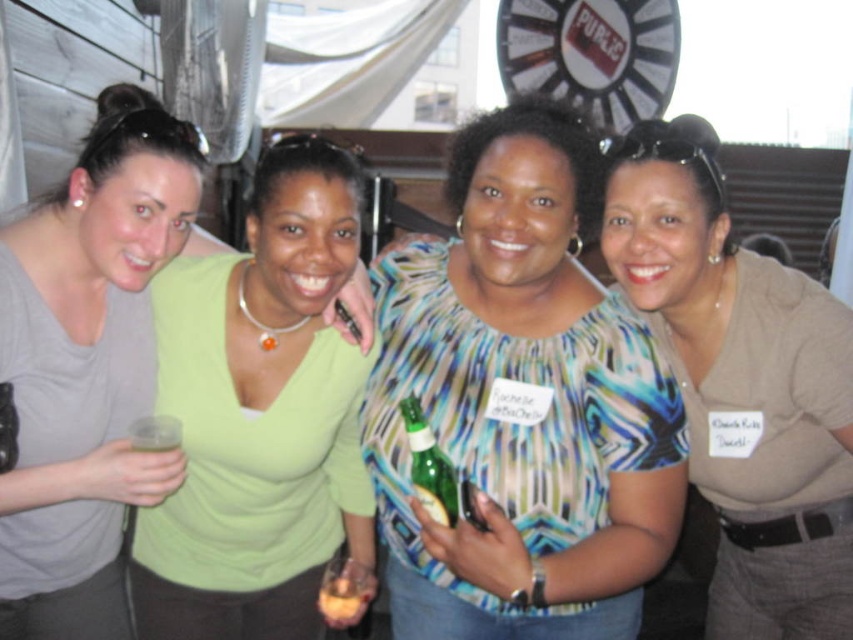
Is point (534, 140) positioned in front of point (442, 470)?

That is False.

Is striped fabric blouse at center thinner than green glass bottle at center?

→ No.

Identify the location of striped fabric blouse at center. The height and width of the screenshot is (640, 853). (521, 401).

Identify the location of striped fabric blouse at center. (521, 401).

Between point (260, 364) and point (109, 164), which one is positioned in front?

Point (109, 164)

Is green matte shirt at center wider than matte gray shirt at left?

Yes, green matte shirt at center is wider than matte gray shirt at left.

This screenshot has height=640, width=853. What do you see at coordinates (259, 417) in the screenshot?
I see `green matte shirt at center` at bounding box center [259, 417].

Locate an element on the screen. Image resolution: width=853 pixels, height=640 pixels. green matte shirt at center is located at coordinates (259, 417).

Is striped fabric blouse at center wider than green matte shirt at center?

Yes, striped fabric blouse at center is wider than green matte shirt at center.

From the picture: Is striped fabric blouse at center to the left of green matte shirt at center from the viewer's perspective?

No, striped fabric blouse at center is not to the left of green matte shirt at center.

Locate an element on the screen. The height and width of the screenshot is (640, 853). striped fabric blouse at center is located at coordinates (521, 401).